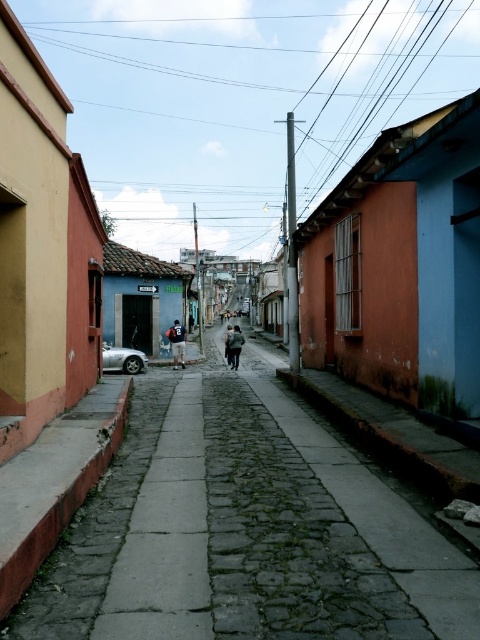
Question: Which of the following is the closest to the observer?

Choices:
 (A) (144, 356)
 (B) (396, 608)

Answer: (B)

Question: Does gray cobblestone pavement at center lie in front of silver metallic car at left?

Choices:
 (A) yes
 (B) no

Answer: (A)

Question: Considering the relative positions of gray cobblestone pavement at center and silver metallic car at left in the image provided, where is gray cobblestone pavement at center located with respect to silver metallic car at left?

Choices:
 (A) left
 (B) right

Answer: (B)

Question: Where is gray cobblestone pavement at center located in relation to silver metallic car at left in the image?

Choices:
 (A) left
 (B) right

Answer: (B)